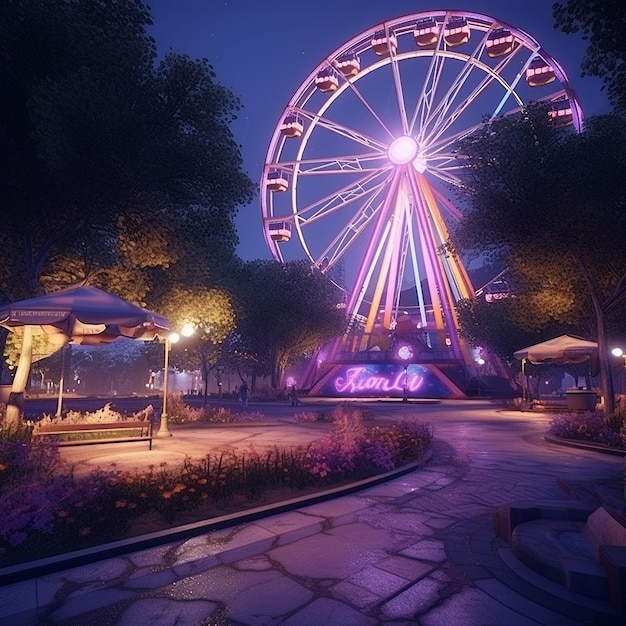
Locate an element on the screen. The image size is (626, 626). planters is located at coordinates (110, 493), (239, 473), (376, 434), (577, 416), (185, 413), (105, 409).